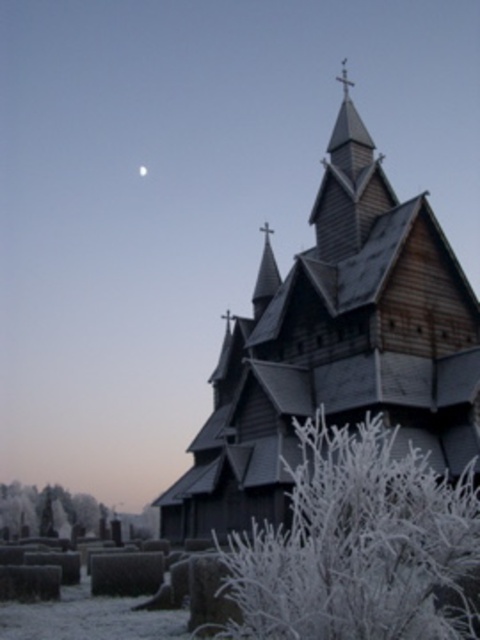
You are an architect assessing the spatial dimensions of the scene. Given that the frosted white branches at center are 1 meter wide, can you determine if the wooden church at center will fit through a standard doorway that is 1.2 meters wide?

The wooden church at center is wider than the frosted white branches at center, which are 1 meter wide. Since the church is wider than 1 meter and the doorway is 1.2 meters wide, it might not fit through the doorway unless it can be disassembled.

You are a maintenance worker needing to reach the frosted white branches at center from the wooden church at center. Given that your ladder is 10 meters long, will it be sufficient to bridge the gap between them?

The distance between wooden church at center and frosted white branches at center is 12.09 meters. Since the ladder is only 10 meters long, it is insufficient to bridge the gap between them.

You are standing at the point marked by coordinates point [336,346]. What is the most prominent structure you see in this scene?

The point [336,346] indicates the wooden church at center, so the most prominent structure you see is the wooden church at center.